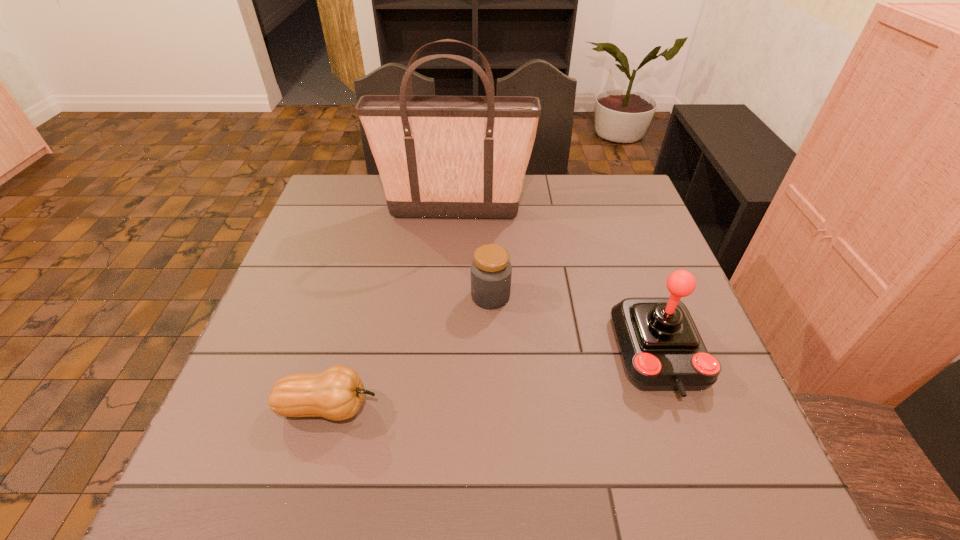
This screenshot has height=540, width=960. In the image, there is a desktop. Identify the location of vacant space at the far right corner. (588, 196).

You are a GUI agent. You are given a task and a screenshot of the screen. Output one action in this format:
    pyautogui.click(x=<x>, y=<y>)
    Task: Click on the free area in between the shortest object and the rightmost object
    
    Given the screenshot: What is the action you would take?
    pyautogui.click(x=493, y=380)

Where is `free space between the gourd and the second shortest object`? free space between the gourd and the second shortest object is located at coordinates (409, 352).

Find the location of a particular element. This screenshot has height=540, width=960. free space that is in between the shortest object and the second shortest object is located at coordinates (409, 352).

Find the location of `free space that is in between the farthest object and the jar`. free space that is in between the farthest object and the jar is located at coordinates (472, 254).

At what (x,y) coordinates should I click in order to perform the action: click on free point between the gourd and the farthest object. Please return your answer as a coordinate pair (x, y). Looking at the image, I should click on (391, 309).

This screenshot has height=540, width=960. What are the coordinates of `free point between the second tallest object and the jar` in the screenshot? It's located at (575, 325).

Find the location of a particular element. free space that is in between the joystick and the shortest object is located at coordinates (493, 380).

At what (x,y) coordinates should I click in order to perform the action: click on free spot between the tallest object and the second tallest object. Please return your answer as a coordinate pair (x, y). This screenshot has height=540, width=960. Looking at the image, I should click on (557, 283).

At what (x,y) coordinates should I click in order to perform the action: click on free spot between the shortest object and the rightmost object. Please return your answer as a coordinate pair (x, y). The image size is (960, 540). Looking at the image, I should click on (493, 380).